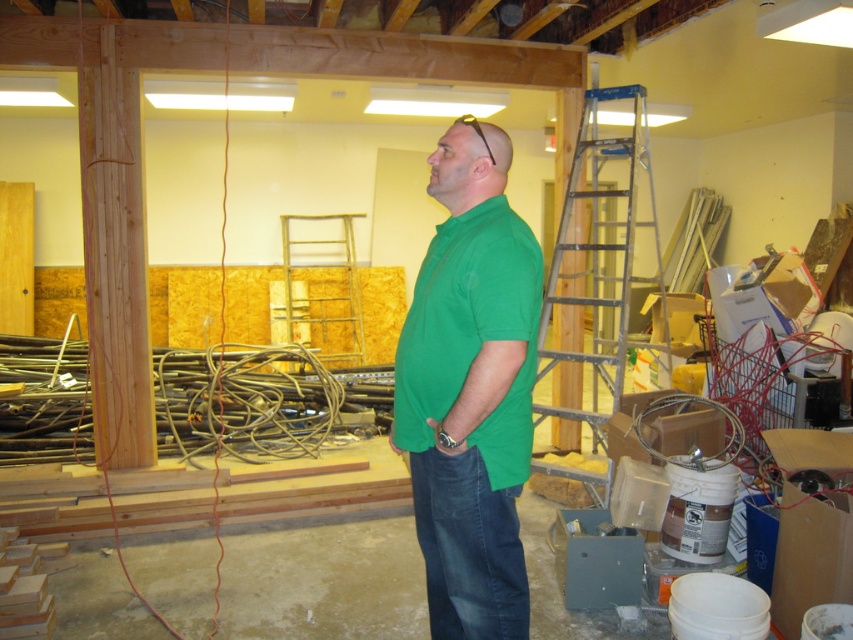
Is point (613, 161) behind point (350, 225)?

Yes, it is.

Is point (614, 394) less distant than point (363, 332)?

Yes, it is.

What do you see at coordinates (596, 260) in the screenshot? I see `silver metallic ladder at right` at bounding box center [596, 260].

Find the location of a particular element. The height and width of the screenshot is (640, 853). silver metallic ladder at right is located at coordinates (596, 260).

You are a GUI agent. You are given a task and a screenshot of the screen. Output one action in this format:
    pyautogui.click(x=<x>, y=<y>)
    Task: Click on the green matte shirt at center
    The width and height of the screenshot is (853, 640).
    Given the screenshot: What is the action you would take?
    pyautogui.click(x=469, y=388)

Is point (445, 353) positioned before point (335, 358)?

Yes, point (445, 353) is closer to viewer.

Locate an element on the screen. green matte shirt at center is located at coordinates (469, 388).

In order to click on green matte shirt at center in this screenshot , I will do `click(469, 388)`.

Is green matte shirt at center further to camera compared to silver metallic ladder at right?

No, it is not.

Is point (395, 403) farther from camera compared to point (604, 200)?

No, it is in front of (604, 200).

Locate an element on the screen. The width and height of the screenshot is (853, 640). green matte shirt at center is located at coordinates (469, 388).